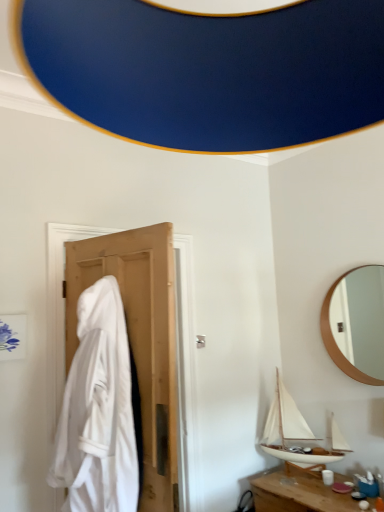
Image resolution: width=384 pixels, height=512 pixels. Find the location of `vacant region above wooden table at lower right (from a real-world perspective)`. vacant region above wooden table at lower right (from a real-world perspective) is located at coordinates (313, 487).